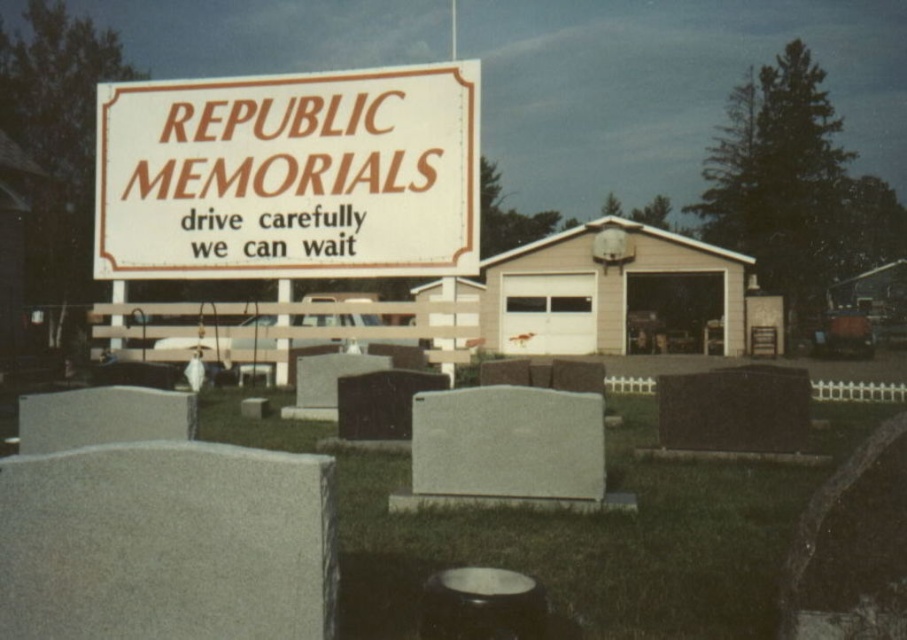
Question: Observing the image, what is the correct spatial positioning of white plastic sign at upper center in reference to gray granite gravestone at center?

Choices:
 (A) right
 (B) left

Answer: (B)

Question: Is white plastic sign at upper center positioned in front of gray granite gravestone at center?

Choices:
 (A) yes
 (B) no

Answer: (B)

Question: Can you confirm if white plastic sign at upper center is positioned to the right of gray granite gravestone at center?

Choices:
 (A) yes
 (B) no

Answer: (B)

Question: Which of the following is the farthest from the observer?

Choices:
 (A) (508, 436)
 (B) (140, 109)

Answer: (B)

Question: Among these objects, which one is nearest to the camera?

Choices:
 (A) white plastic sign at upper center
 (B) gray granite gravestone at center

Answer: (B)